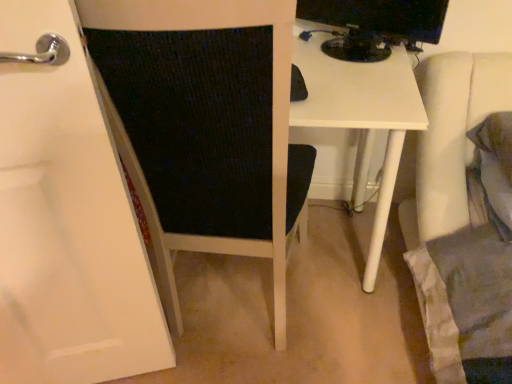
Question: From the image's perspective, relative to black glossy monitor at upper right, is black fabric chair at left above or below?

Choices:
 (A) above
 (B) below

Answer: (B)

Question: In the image, is black fabric chair at left positioned in front of or behind black glossy monitor at upper right?

Choices:
 (A) behind
 (B) front

Answer: (B)

Question: Is point (185, 107) closer or farther from the camera than point (362, 46)?

Choices:
 (A) closer
 (B) farther

Answer: (A)

Question: Considering the positions of black glossy monitor at upper right and black fabric chair at left in the image, is black glossy monitor at upper right taller or shorter than black fabric chair at left?

Choices:
 (A) tall
 (B) short

Answer: (B)

Question: From a real-world perspective, is black glossy monitor at upper right above or below black fabric chair at left?

Choices:
 (A) above
 (B) below

Answer: (A)

Question: Is black glossy monitor at upper right bigger or smaller than black fabric chair at left?

Choices:
 (A) small
 (B) big

Answer: (A)

Question: Considering the relative positions of black glossy monitor at upper right and black fabric chair at left in the image provided, is black glossy monitor at upper right to the left or to the right of black fabric chair at left?

Choices:
 (A) right
 (B) left

Answer: (A)